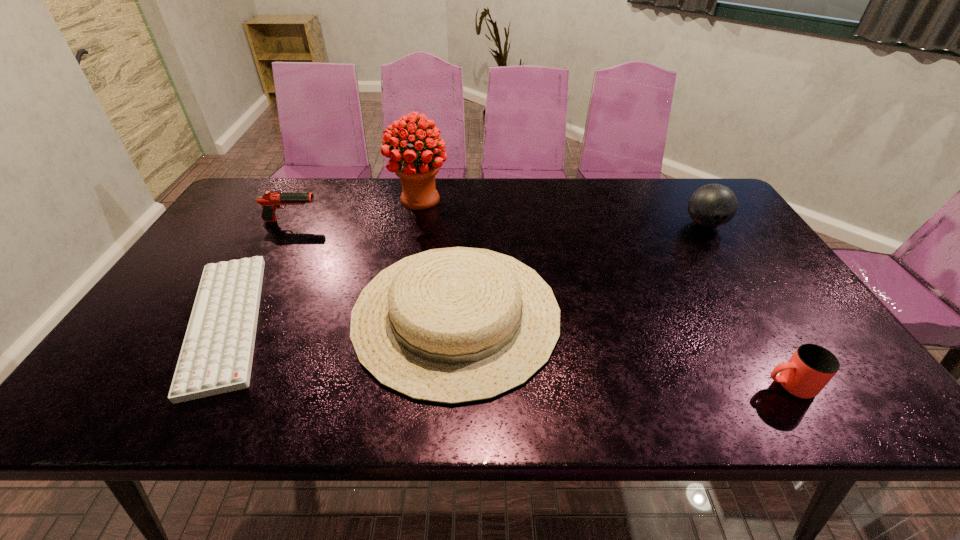
The width and height of the screenshot is (960, 540). Identify the location of the tallest object. (417, 171).

What are the coordinates of `the second tallest object` in the screenshot? It's located at (713, 205).

The height and width of the screenshot is (540, 960). In order to click on gun in this screenshot , I will do `click(271, 200)`.

Locate an element on the screen. Image resolution: width=960 pixels, height=540 pixels. sunhat is located at coordinates pos(454,325).

Find the location of a particular element. This screenshot has width=960, height=540. cup is located at coordinates (810, 368).

At what (x,y) coordinates should I click in order to perform the action: click on the shortest object. Please return your answer as a coordinate pair (x, y). The image size is (960, 540). Looking at the image, I should click on (216, 357).

Where is `free location located 0.170m on the left of the bouquet`? Image resolution: width=960 pixels, height=540 pixels. free location located 0.170m on the left of the bouquet is located at coordinates click(x=339, y=199).

The width and height of the screenshot is (960, 540). I want to click on free space located 0.160m on the grip area of the bowling ball, so click(736, 273).

Image resolution: width=960 pixels, height=540 pixels. Identify the location of vacant area situated at the aiming end of the gun. (386, 221).

Where is `free space located on the back of the sunhat`? The height and width of the screenshot is (540, 960). free space located on the back of the sunhat is located at coordinates (464, 181).